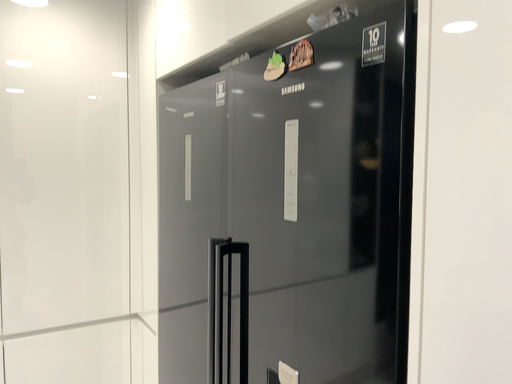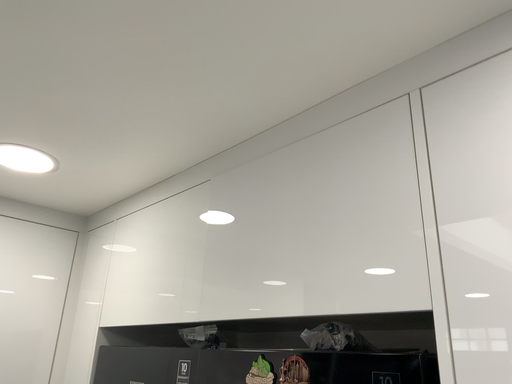
Question: Which way did the camera rotate in the video?

Choices:
 (A) rotated downward
 (B) rotated upward

Answer: (B)